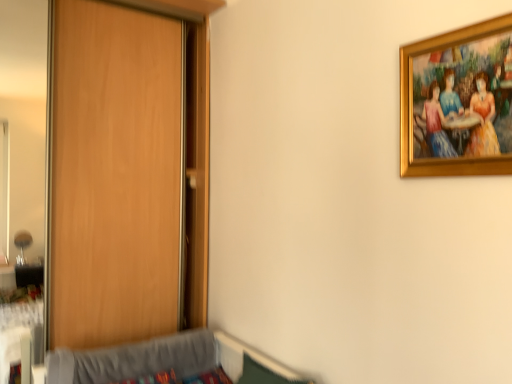
Question: Considering the positions of point (69, 200) and point (244, 382), is point (69, 200) closer or farther from the camera than point (244, 382)?

Choices:
 (A) farther
 (B) closer

Answer: (A)

Question: Considering the positions of wooden door at left and gray fabric hospital bed at lower left in the image, is wooden door at left bigger or smaller than gray fabric hospital bed at lower left?

Choices:
 (A) small
 (B) big

Answer: (B)

Question: Estimate the real-world distances between objects in this image. Which object is farther from the wooden door at left?

Choices:
 (A) gray fabric hospital bed at lower left
 (B) gold-framed painting at upper right

Answer: (B)

Question: Based on their relative distances, which object is farther from the wooden door at left?

Choices:
 (A) gray fabric hospital bed at lower left
 (B) gold-framed painting at upper right

Answer: (B)